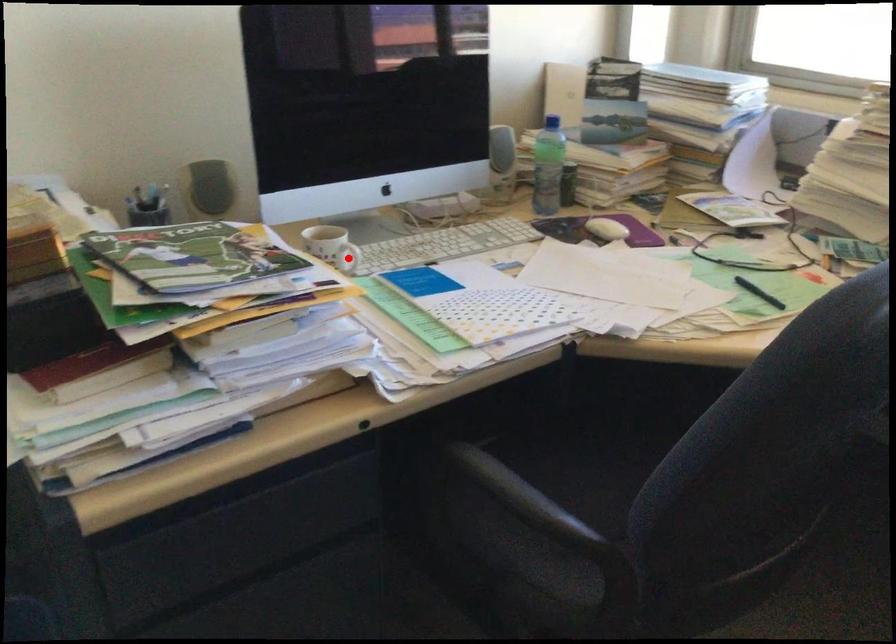
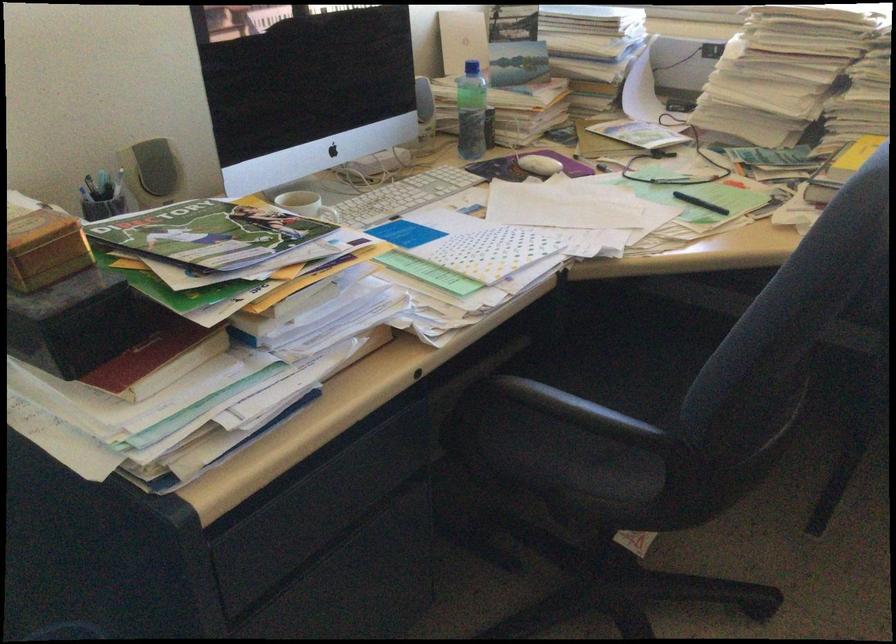
Question: I am providing you with two images of the same scene from different viewpoints. A red point is marked on the first image. Is the red point's position out of view in image 2?

Choices:
 (A) Yes
 (B) No

Answer: (A)